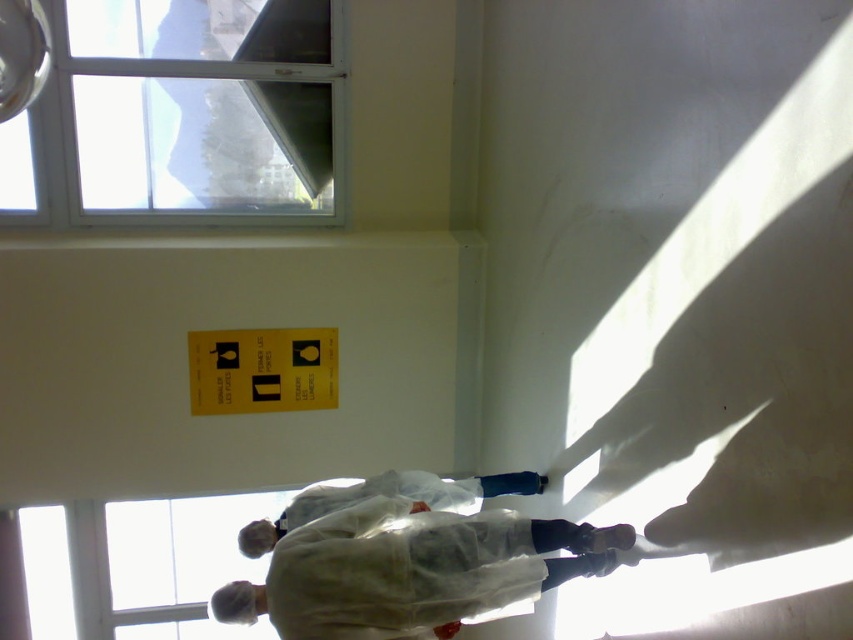
You are a researcher in the lab. You need to observe something through the transparent glass window at upper left but your white matte lab coat at center is blocking your view. Can you move to the side to see through the window?

The white matte lab coat at center is behind the transparent glass window at upper left, so moving to the side might allow you to see through the window by stepping around the coat or adjusting your position to avoid obstruction.

You are a researcher in the lab and need to locate the transparent glass window at upper left. From your current position at the white matte lab coat at center, in which direction should you move to reach it?

The transparent glass window at upper left is positioned over the white matte lab coat at center, so you should move upward to reach it.